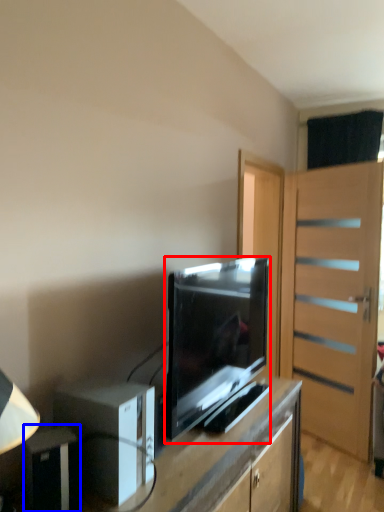
Question: Among these objects, which one is nearest to the camera, television (highlighted by a red box) or appliance (highlighted by a blue box)?

Choices:
 (A) television
 (B) appliance

Answer: (B)